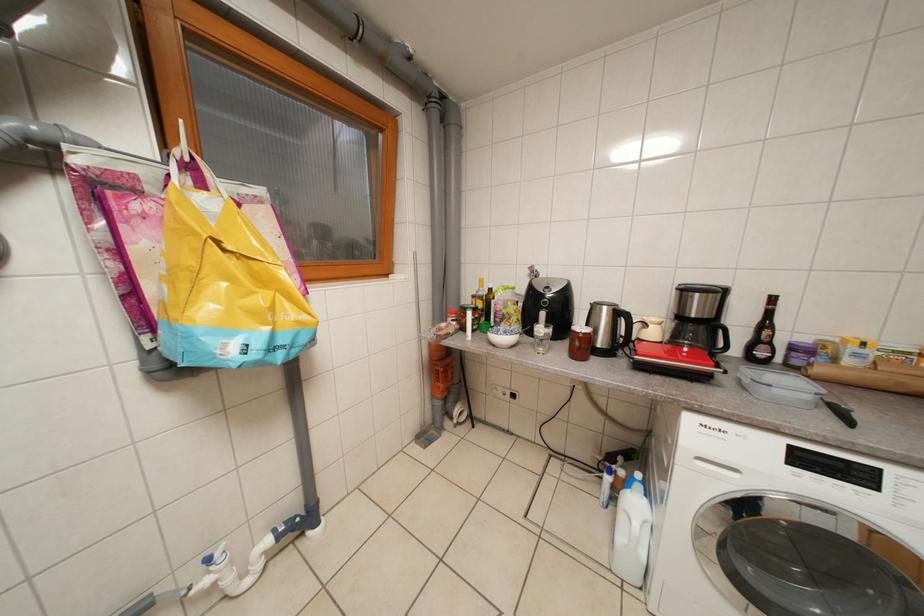
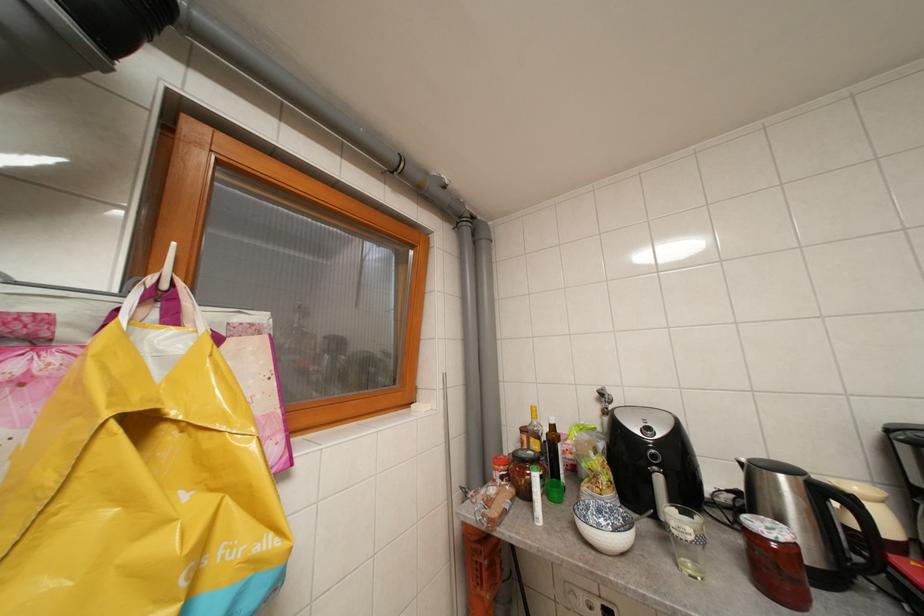
Which direction would the cameraman need to move to produce the second image?

The cameraman moved toward left, forward.